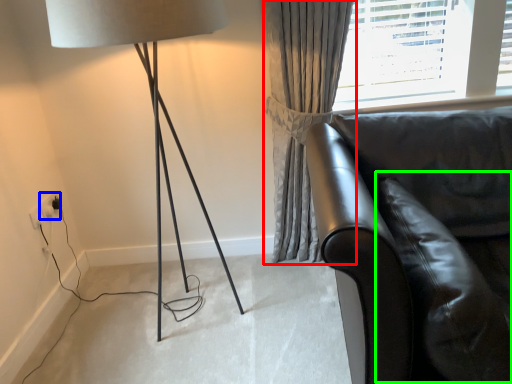
Question: Estimate the real-world distances between objects in this image. Which object is farther from curtain (highlighted by a red box), electric outlet (highlighted by a blue box) or swivel chair (highlighted by a green box)?

Choices:
 (A) electric outlet
 (B) swivel chair

Answer: (A)